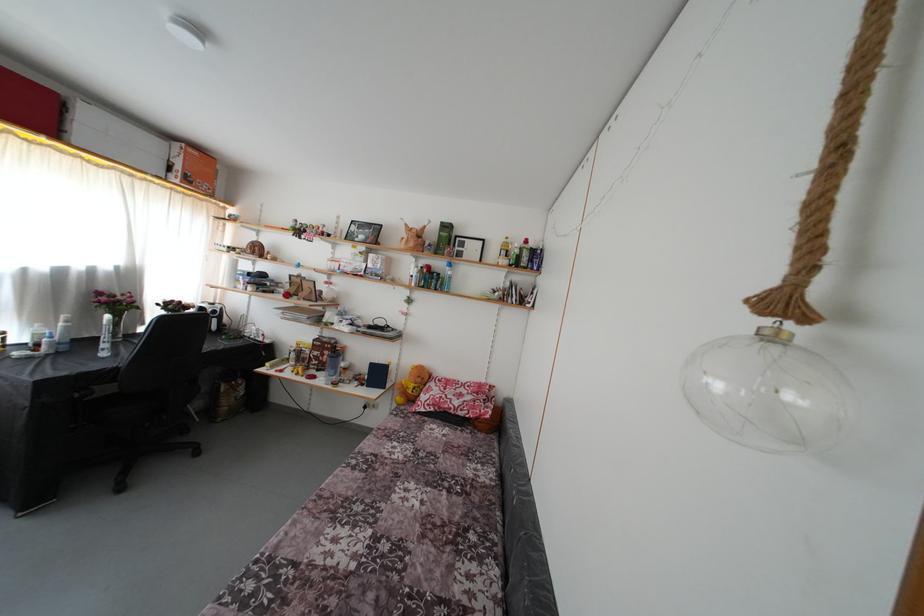
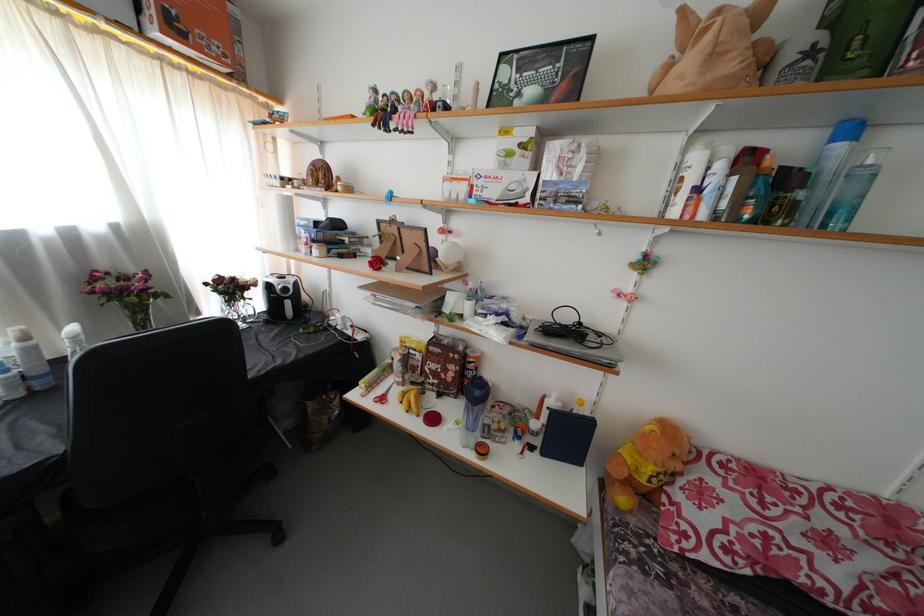
The images are taken continuously from a first-person perspective. In which direction are you moving?

The movement direction of the cameraman is left, forward.